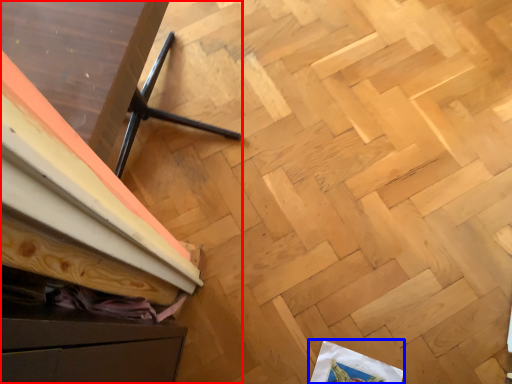
Question: Which object appears farthest to the camera in this image, furniture (highlighted by a red box) or wrapping paper (highlighted by a blue box)?

Choices:
 (A) furniture
 (B) wrapping paper

Answer: (B)